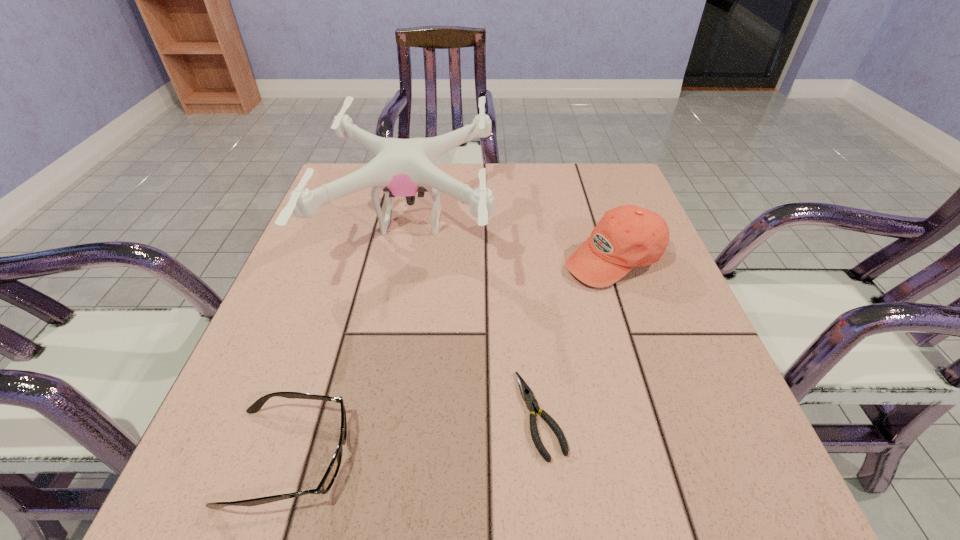
In order to click on free spot that satisfies the following two spatial constraints: 1. on the front side of the baseball cap; 2. on the front-facing side of the second shortest object in this screenshot , I will do `click(682, 457)`.